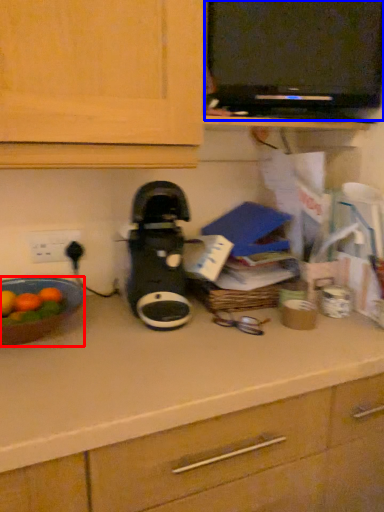
Question: Among these objects, which one is farthest to the camera, kitchen appliance (highlighted by a red box) or appliance (highlighted by a blue box)?

Choices:
 (A) kitchen appliance
 (B) appliance

Answer: (B)